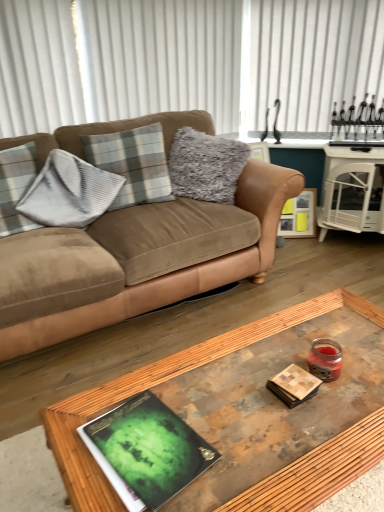
Where is `free point to the left of matte brown book at center`? This screenshot has height=512, width=384. free point to the left of matte brown book at center is located at coordinates (241, 394).